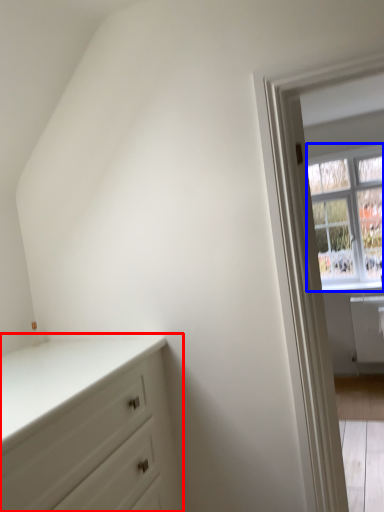
Question: Which object appears closest to the camera in this image, chest of drawers (highlighted by a red box) or window (highlighted by a blue box)?

Choices:
 (A) chest of drawers
 (B) window

Answer: (A)